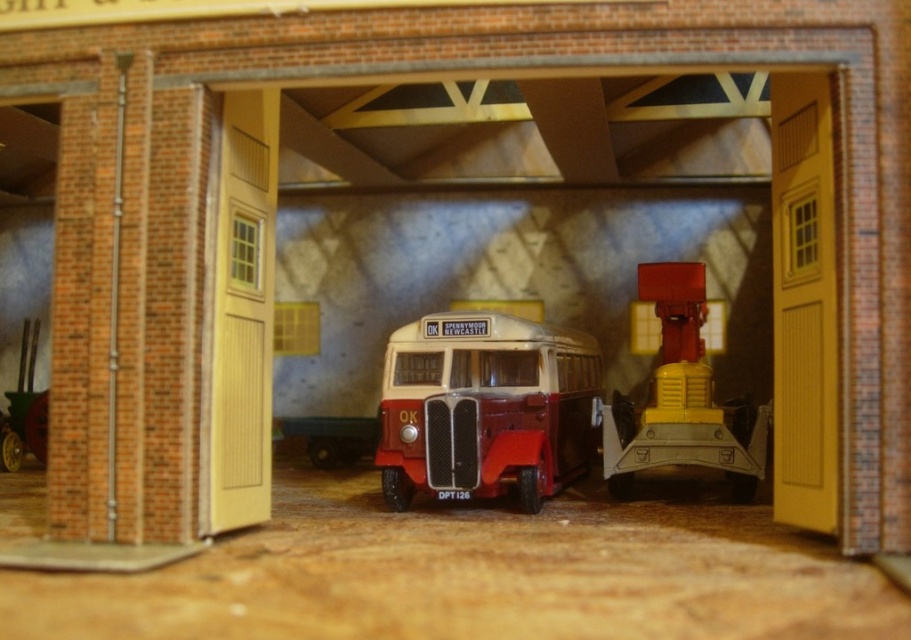
Which is above, matte red bus at center or metallic yellow and red crane at center?

metallic yellow and red crane at center

Can you confirm if matte red bus at center is shorter than metallic yellow and red crane at center?

Indeed, matte red bus at center has a lesser height compared to metallic yellow and red crane at center.

The image size is (911, 640). Describe the element at coordinates (485, 408) in the screenshot. I see `matte red bus at center` at that location.

Where is `matte red bus at center`? matte red bus at center is located at coordinates (485, 408).